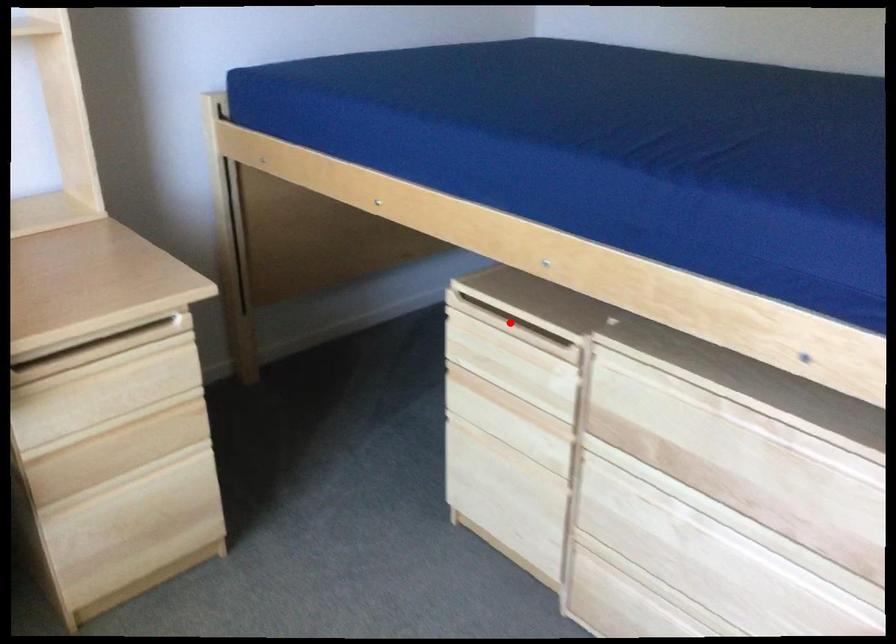
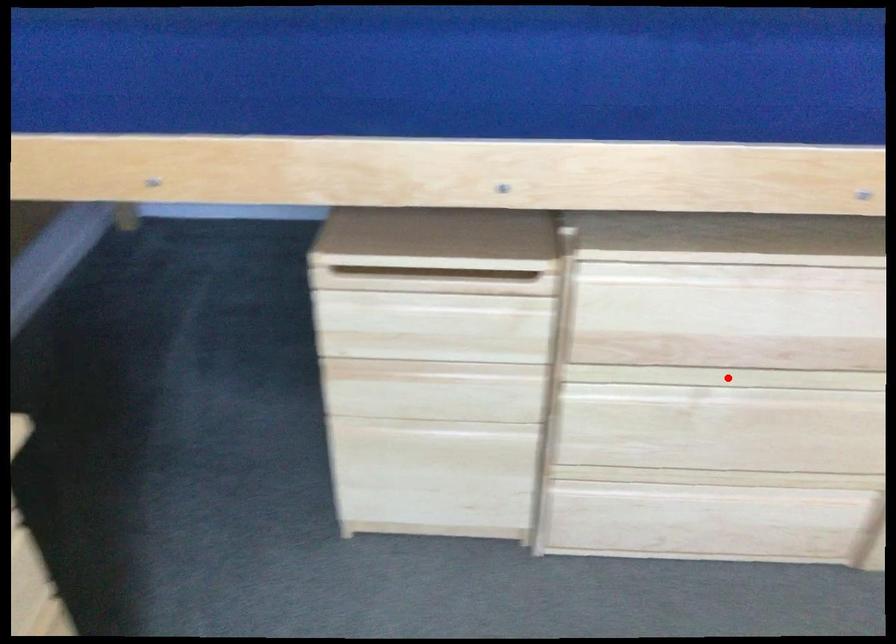
I am providing you with two images of the same scene from different viewpoints. A red point is marked on the first image and another point is marked on the second image. Is the red point in image1 aligned with the point shown in image2?

No